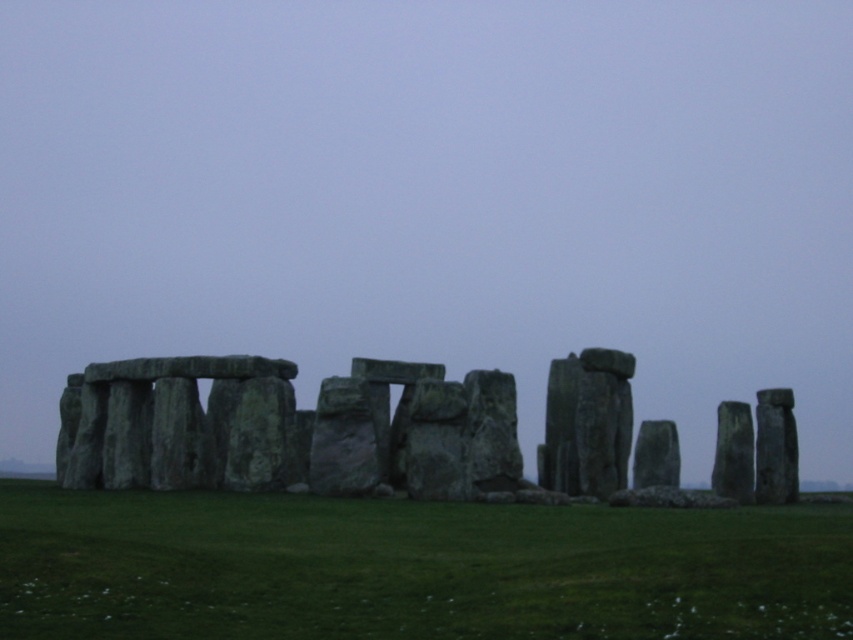
You are a photographer planning to capture a closeup shot of the green grass at center and the green stone at center at Stonehenge. Which object should you focus on if you want to ensure that the smaller one is in sharp focus?

The green grass at center is smaller in size compared to the green stone at center. To ensure the smaller object is in sharp focus, you should focus on the green grass at center.

You are standing at the entrance of Stonehenge and want to place a small flag exactly halfway between the green grass at center and the green stone at center. Which object will the flag be closer to?

The flag will be closer to the green grass at center because it is closer to the viewer than the green stone at center.

You are standing at the center of Stonehenge and notice a point marked at coordinates (412, 568). What is located at this point?

The point at coordinates (412, 568) corresponds to green grass at center.